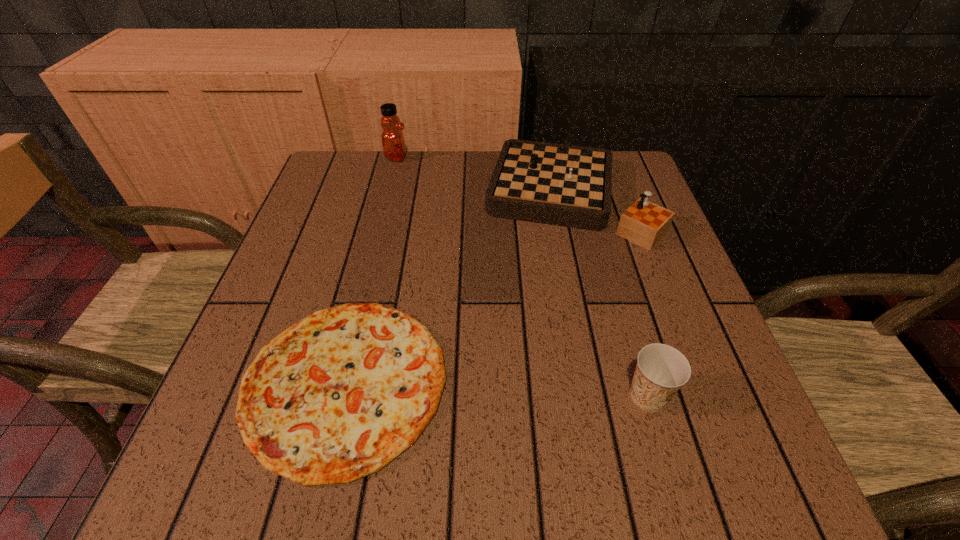
Locate an element on the screen. The height and width of the screenshot is (540, 960). honey is located at coordinates (393, 142).

Find the location of a particular element. The width and height of the screenshot is (960, 540). chessboard is located at coordinates (566, 185).

This screenshot has height=540, width=960. What are the coordinates of `Dixie cup` in the screenshot? It's located at (661, 370).

Where is `pizza`? The image size is (960, 540). pizza is located at coordinates (337, 396).

Image resolution: width=960 pixels, height=540 pixels. Identify the location of free space located on the front label of the tallest object. (509, 157).

You are a GUI agent. You are given a task and a screenshot of the screen. Output one action in this format:
    pyautogui.click(x=<x>, y=<y>)
    Task: Click on the free space located 0.290m on the left of the chessboard
    Image resolution: width=960 pixels, height=540 pixels.
    Given the screenshot: What is the action you would take?
    pyautogui.click(x=365, y=197)

Image resolution: width=960 pixels, height=540 pixels. I want to click on free space located on the back of the Dixie cup, so click(x=621, y=305).

Find the location of `vacant region located 0.100m on the right of the pizza`. vacant region located 0.100m on the right of the pizza is located at coordinates (509, 383).

The image size is (960, 540). In order to click on honey that is at the far edge in this screenshot , I will do `click(393, 142)`.

The height and width of the screenshot is (540, 960). Identify the location of chessboard located in the far edge section of the desktop. (566, 185).